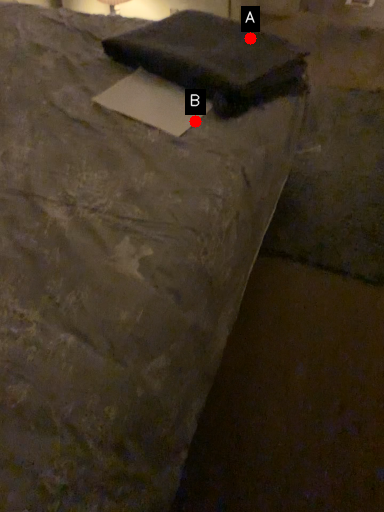
Question: Two points are circled on the image, labeled by A and B beside each circle. Which point is farther from the camera taking this photo?

Choices:
 (A) A is further
 (B) B is further

Answer: (A)